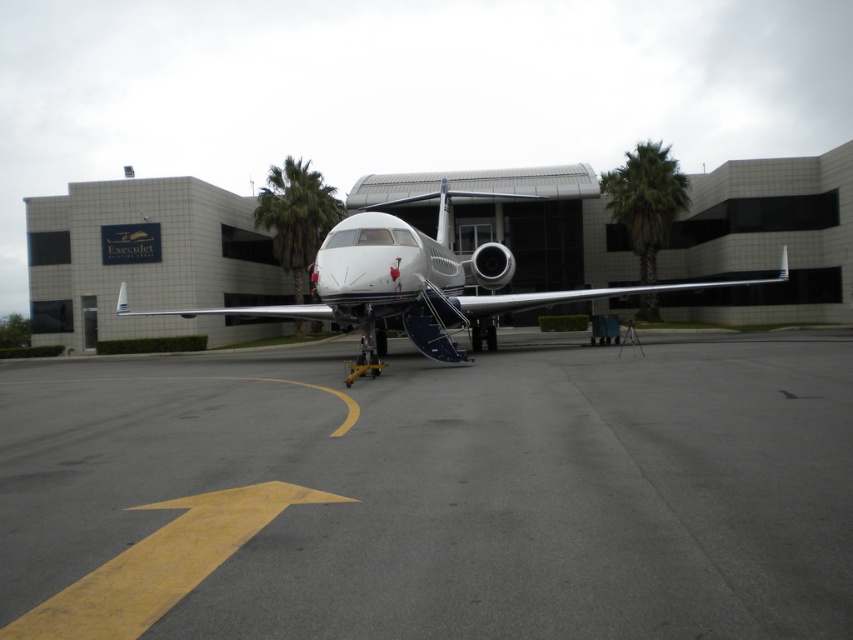
You are a pilot who needs to park your airplane properly. Based on the image, where should the white metallic airplane at center be positioned relative to the gray asphalt tarmac at center?

The gray asphalt tarmac at center is below the white metallic airplane at center, so the airplane should be positioned above the gray asphalt tarmac at center to park properly.

You are a pilot who needs to park your airplane. You see the gray asphalt tarmac at center and the white metallic airplane at center. Which surface is lower in height?

The gray asphalt tarmac at center has a lesser height compared to the white metallic airplane at center, so the gray asphalt tarmac at center is lower.